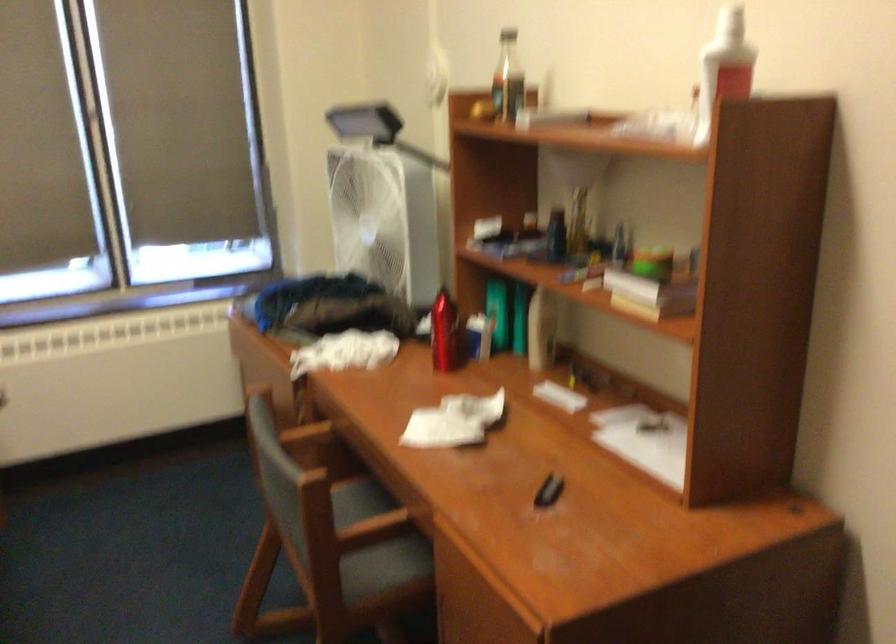
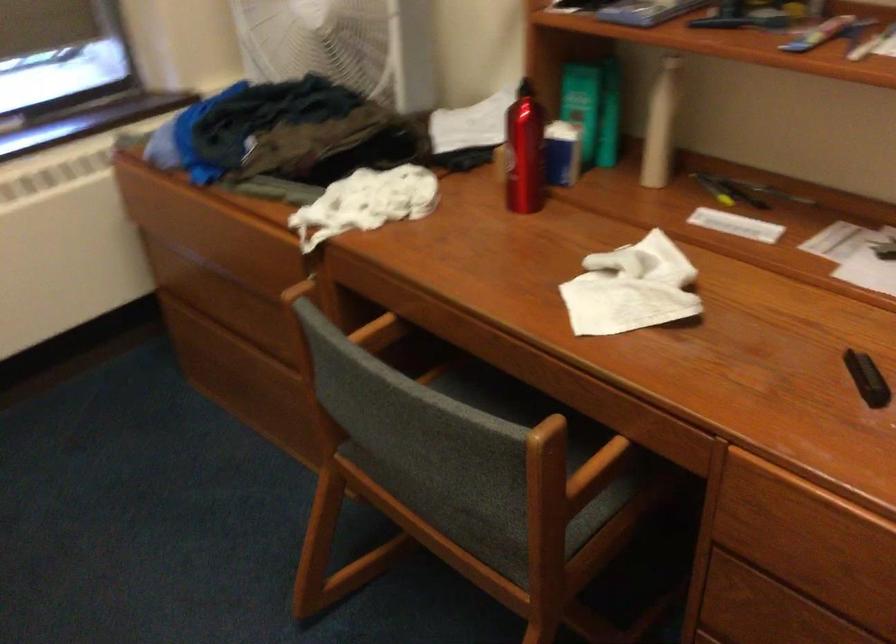
Find the pixel in the second image that matches (532,325) in the first image.

(659, 125)